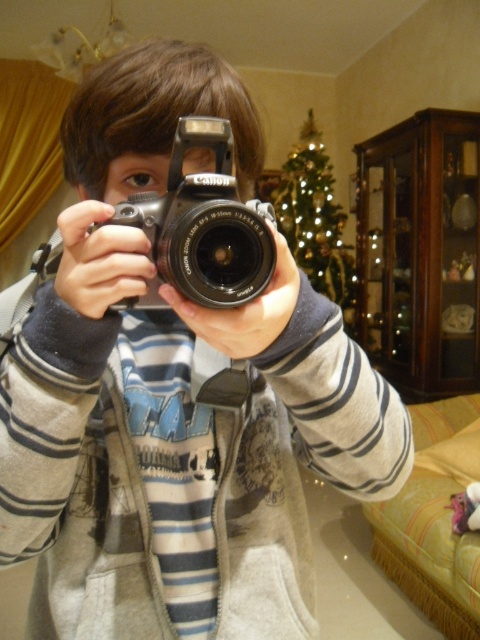
Question: Among these objects, which one is farthest from the camera?

Choices:
 (A) green textured christmas tree at upper center
 (B) black plastic camera at center

Answer: (A)

Question: Which object appears farthest from the camera in this image?

Choices:
 (A) green textured christmas tree at upper center
 (B) black plastic camera at center

Answer: (A)

Question: Can you confirm if black plastic camera at center is positioned below green textured christmas tree at upper center?

Choices:
 (A) no
 (B) yes

Answer: (B)

Question: Can you confirm if black plastic camera at center is smaller than green textured christmas tree at upper center?

Choices:
 (A) yes
 (B) no

Answer: (A)

Question: Is black plastic camera at center further to camera compared to green textured christmas tree at upper center?

Choices:
 (A) no
 (B) yes

Answer: (A)